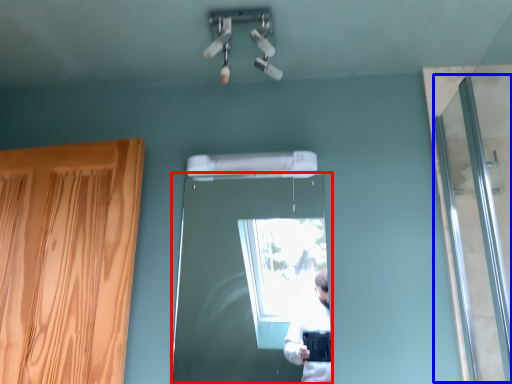
Question: Among these objects, which one is farthest to the camera, door (highlighted by a red box) or screen door (highlighted by a blue box)?

Choices:
 (A) door
 (B) screen door

Answer: (A)